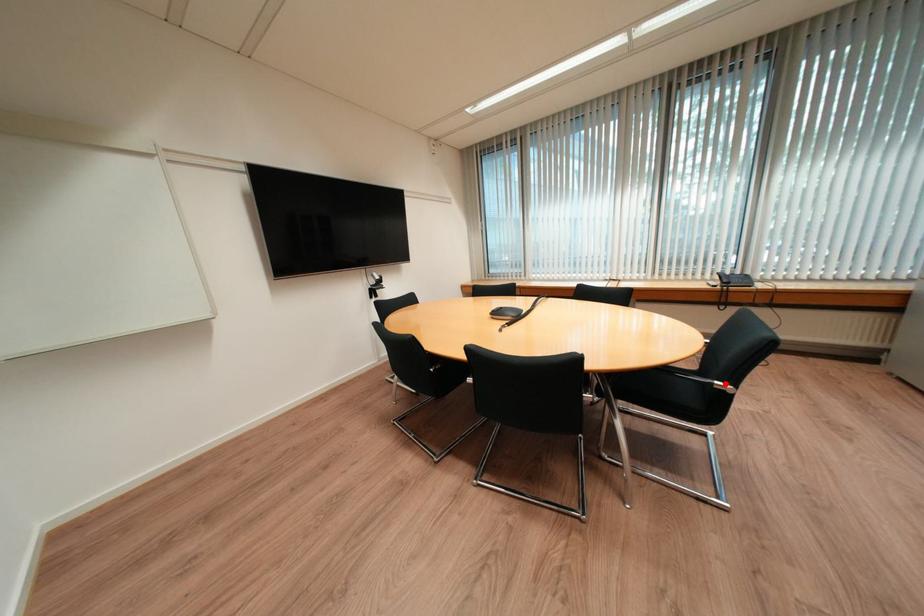
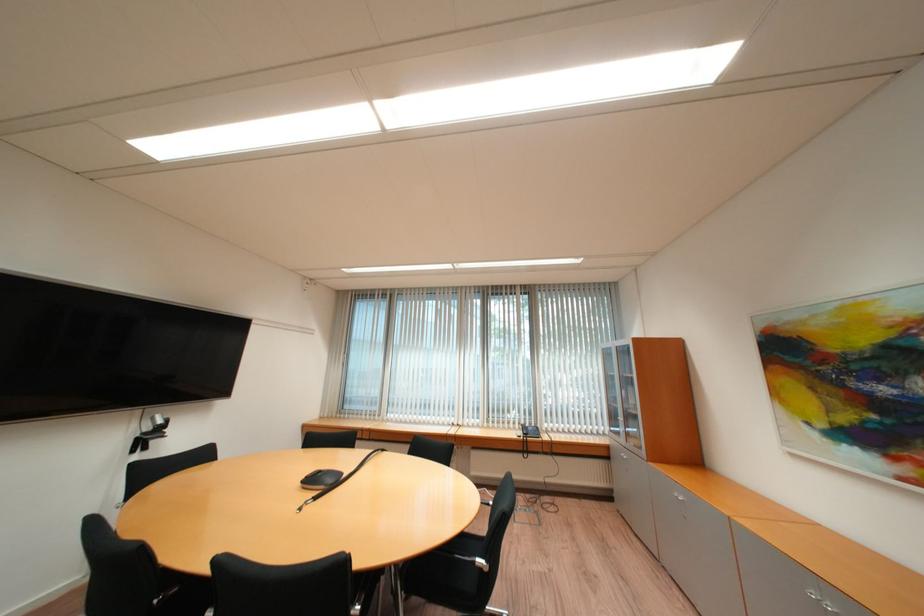
Question: A red point is marked in image1. In image2, is the corresponding 3D point closer to the camera or farther? Reply with the corresponding letter.

Choices:
 (A) The corresponding 3D point is closer.
 (B) The corresponding 3D point is farther.

Answer: (A)